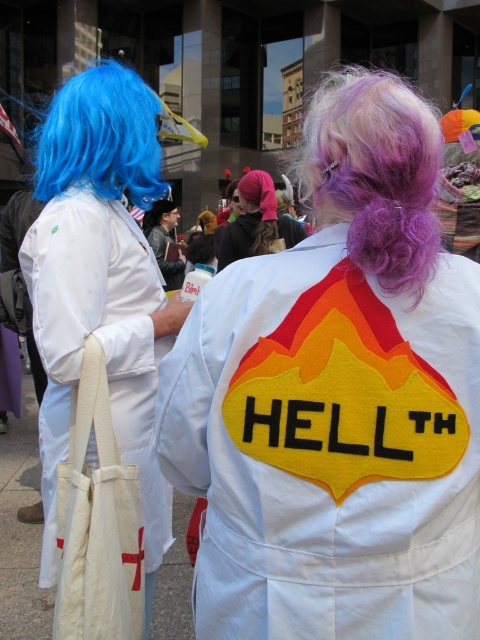
You are standing in the crowd observing the two individuals in white coats. There are two points marked in the image. Which point, point 1 at coordinates (360,371) or point 2 at coordinates (218,256), is closer to you?

Point 1 at coordinates (360,371) is closer to the viewer than point 2 at coordinates (218,256).

You are a photographer standing at the edge of the crowd, trying to capture a photo of both the white felt coat at center and the pink fabric headband at center in the same frame. The camera you are using has a maximum focus range of 10 feet. Will you be able to include both objects in focus without moving closer?

The white felt coat at center is 10.86 feet from the pink fabric headband at center. Since the distance between them exceeds the camera maximum focus range of 10 feet, you will not be able to capture both in focus without moving closer.

You are standing at the point labeled as point (135, 109) in the image. You want to throw a small ball to someone located exactly behind you, 2.13 meters away. Will the ball travel past the person with blue hair and the beige bag with a red cross?

The point (135, 109) is 2.13 meters away from the viewer. Since the target is exactly behind you at that distance, the ball will travel directly away from you and won spatial reasoning questions and answers from provided descriptions of scenes. 2.13 meters away, so the ball will go straight back and not pass near the person with blue hair and the beige bag with a red cross unless they are in that exact line of travel. However, the scene description mentions the person with blue hair is on the left, so if